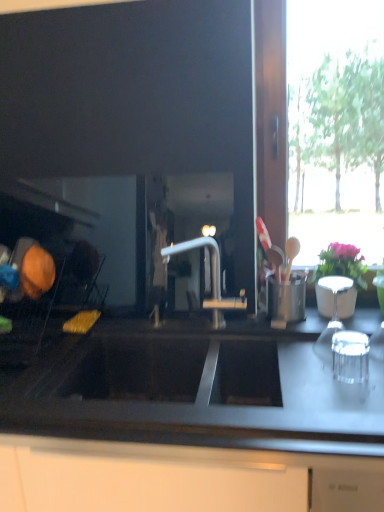
Measure the distance between black matte countertop at center and camera.

black matte countertop at center is 29.86 inches away from camera.

Identify the location of black matte countertop at center. Image resolution: width=384 pixels, height=512 pixels. (197, 389).

What do you see at coordinates (197, 389) in the screenshot? I see `black matte countertop at center` at bounding box center [197, 389].

Image resolution: width=384 pixels, height=512 pixels. Identify the location of pink matte vase at upper right. click(341, 264).

What is the approximate width of pink matte vase at upper right?

It is 14.75 centimeters.

What do you see at coordinates (341, 264) in the screenshot? The image size is (384, 512). I see `pink matte vase at upper right` at bounding box center [341, 264].

Find the location of a particular element. The image size is (384, 512). black matte countertop at center is located at coordinates (197, 389).

Can you confirm if black matte countertop at center is positioned to the left of pink matte vase at upper right?

Correct, you'll find black matte countertop at center to the left of pink matte vase at upper right.

Is black matte countertop at center positioned behind pink matte vase at upper right?

A: No.

Is point (187, 342) positioned after point (345, 261)?

That is False.

From the image's perspective, which is below, black matte countertop at center or pink matte vase at upper right?

black matte countertop at center.

From a real-world perspective, between black matte countertop at center and pink matte vase at upper right, who is vertically higher?

pink matte vase at upper right, from a real-world perspective.

Considering the sizes of black matte countertop at center and pink matte vase at upper right in the image, is black matte countertop at center wider or thinner than pink matte vase at upper right?

black matte countertop at center is wider than pink matte vase at upper right.

Considering the relative sizes of black matte countertop at center and pink matte vase at upper right in the image provided, is black matte countertop at center taller than pink matte vase at upper right?

Correct, black matte countertop at center is much taller as pink matte vase at upper right.

Who is bigger, black matte countertop at center or pink matte vase at upper right?

With larger size is black matte countertop at center.

Is black matte countertop at center located outside pink matte vase at upper right?

Yes, black matte countertop at center is outside of pink matte vase at upper right.

Does black matte countertop at center touch pink matte vase at upper right?

No, black matte countertop at center is not next to pink matte vase at upper right.

Could you tell me if black matte countertop at center is turned towards pink matte vase at upper right?

No, black matte countertop at center is not turned towards pink matte vase at upper right.

Measure the distance from black matte countertop at center to pink matte vase at upper right.

black matte countertop at center and pink matte vase at upper right are 19.31 inches apart.

I want to click on flower located behind the black matte countertop at center, so click(341, 264).

Would you say pink matte vase at upper right is to the left or to the right of black matte countertop at center in the picture?

From the image, it's evident that pink matte vase at upper right is to the right of black matte countertop at center.

Is the depth of pink matte vase at upper right less than that of black matte countertop at center?

That is False.

Which is closer to the camera, (331, 246) or (357, 444)?

Point (331, 246) is farther from the camera than point (357, 444).

From the picture: From the image's perspective, is pink matte vase at upper right over black matte countertop at center?

Yes, from the image's perspective, pink matte vase at upper right is above black matte countertop at center.

From a real-world perspective, is pink matte vase at upper right positioned under black matte countertop at center based on gravity?

No, from a real-world perspective, pink matte vase at upper right is not below black matte countertop at center.

Can you confirm if pink matte vase at upper right is thinner than black matte countertop at center?

Indeed, pink matte vase at upper right has a lesser width compared to black matte countertop at center.

Looking at this image, considering the sizes of objects pink matte vase at upper right and black matte countertop at center in the image provided, who is shorter, pink matte vase at upper right or black matte countertop at center?

pink matte vase at upper right is shorter.

Considering the sizes of pink matte vase at upper right and black matte countertop at center in the image, is pink matte vase at upper right bigger or smaller than black matte countertop at center?

Considering their sizes, pink matte vase at upper right takes up less space than black matte countertop at center.

Would you say pink matte vase at upper right is inside or outside black matte countertop at center?

The correct answer is: outside.

Is pink matte vase at upper right far from black matte countertop at center?

They are positioned close to each other.

Consider the image. Is pink matte vase at upper right oriented away from black matte countertop at center?

pink matte vase at upper right does not have its back to black matte countertop at center.

How many degrees apart are the facing directions of pink matte vase at upper right and black matte countertop at center?

pink matte vase at upper right and black matte countertop at center are facing 0.00115 degrees away from each other.

I want to click on flower above the black matte countertop at center (from the image's perspective), so click(x=341, y=264).

You are a GUI agent. You are given a task and a screenshot of the screen. Output one action in this format:
    pyautogui.click(x=<x>, y=<y>)
    Task: Click on the countertop on the left of pink matte vase at upper right
    This screenshot has height=512, width=384.
    Given the screenshot: What is the action you would take?
    pyautogui.click(x=197, y=389)

In the image, there is a black matte countertop at center. Where is `flower above it (from the image's perspective)`? flower above it (from the image's perspective) is located at coordinates (341, 264).